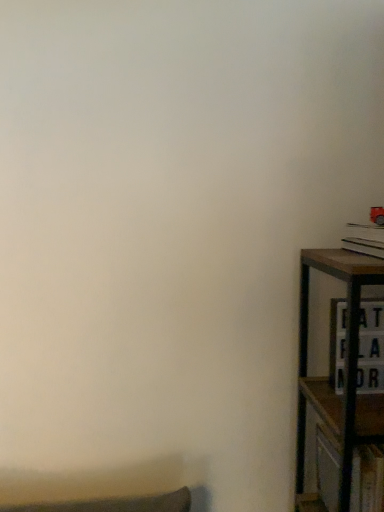
Question: Relative to hardcover book at right, is wooden cabinet at right in front or behind?

Choices:
 (A) behind
 (B) front

Answer: (A)

Question: Considering the positions of wooden cabinet at right and hardcover book at right in the image, is wooden cabinet at right taller or shorter than hardcover book at right?

Choices:
 (A) short
 (B) tall

Answer: (B)

Question: From the image's perspective, is wooden cabinet at right positioned above or below hardcover book at right?

Choices:
 (A) above
 (B) below

Answer: (B)

Question: Considering the positions of hardcover book at right and wooden cabinet at right in the image, is hardcover book at right bigger or smaller than wooden cabinet at right?

Choices:
 (A) big
 (B) small

Answer: (B)

Question: Is hardcover book at right taller or shorter than wooden cabinet at right?

Choices:
 (A) tall
 (B) short

Answer: (B)

Question: From the image's perspective, is hardcover book at right positioned above or below wooden cabinet at right?

Choices:
 (A) below
 (B) above

Answer: (B)

Question: Is point (370, 230) positioned closer to the camera than point (372, 314)?

Choices:
 (A) closer
 (B) farther

Answer: (A)